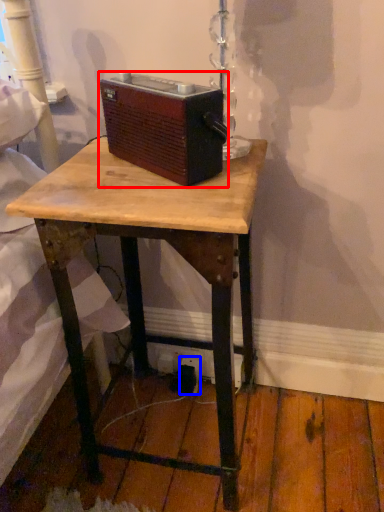
Question: Which of the following is the closest to the observer, gadget (highlighted by a red box) or electric outlet (highlighted by a blue box)?

Choices:
 (A) gadget
 (B) electric outlet

Answer: (A)